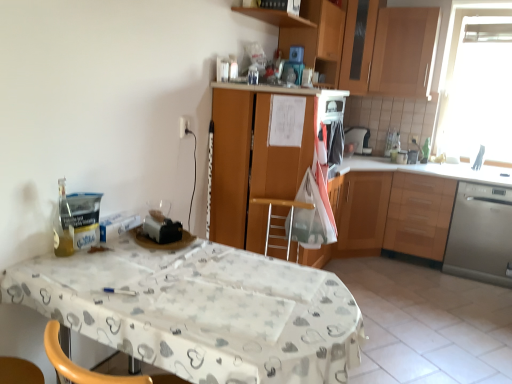
Question: From the image's perspective, is white glossy sink at upper right above or below transparent glass window at upper right?

Choices:
 (A) above
 (B) below

Answer: (B)

Question: In terms of size, does white glossy sink at upper right appear bigger or smaller than transparent glass window at upper right?

Choices:
 (A) big
 (B) small

Answer: (B)

Question: Estimate the real-world distances between objects in this image. Which object is farther from the white glossy tile at lower right?

Choices:
 (A) wooden cabinet at right, the 4th cabinetry from the left
 (B) wooden cabinet at center, which is counted as the first cabinetry, starting from the left
 (C) satin silver dishwasher at right
 (D) wooden shelf at upper center
 (E) white fabric-covered table at center

Answer: (D)

Question: Which is farther from the satin silver dishwasher at right?

Choices:
 (A) wooden cabinet at upper center, acting as the 3th cabinetry starting from the right
 (B) wooden cabinet at center, which is counted as the first cabinetry, starting from the left
 (C) wooden shelf at upper center
 (D) wooden cabinet at upper right, which is the 2th cabinetry from right to left
 (E) wooden cabinet at right, which is the first cabinetry in right-to-left order

Answer: (C)